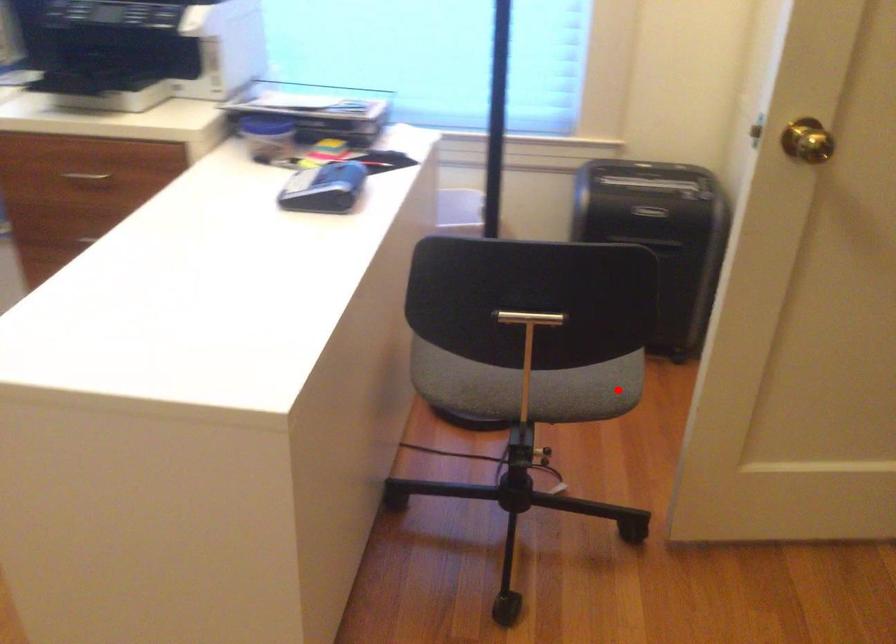
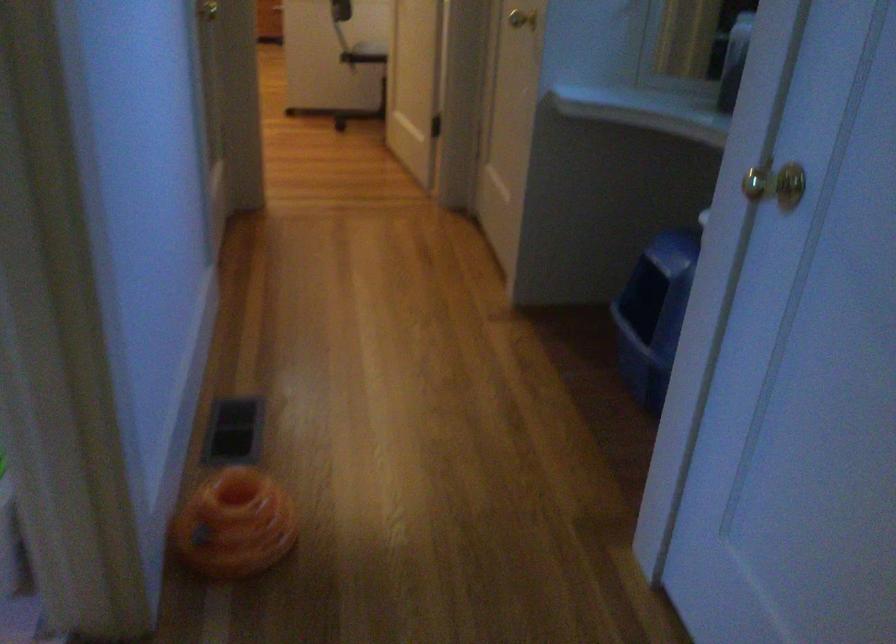
Question: I am providing you with two images of the same scene from different viewpoints. Image1 has a red point marked. In image2, the corresponding 3D location appears at what relative position? Reply with the corresponding letter.

Choices:
 (A) Closer
 (B) Farther

Answer: (B)